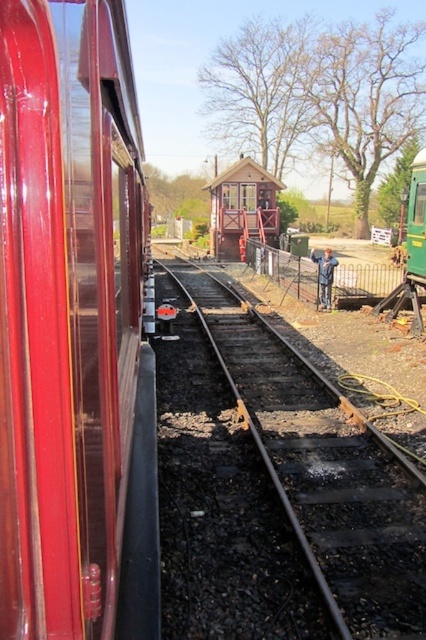
Is shiny red train car at left smaller than black metal track at center?

Yes, shiny red train car at left is smaller than black metal track at center.

Can you confirm if shiny red train car at left is thinner than black metal track at center?

Indeed, shiny red train car at left has a lesser width compared to black metal track at center.

Where is `shiny red train car at left`? This screenshot has width=426, height=640. shiny red train car at left is located at coordinates (74, 330).

Does point (261, 344) come farther from viewer compared to point (422, 195)?

That is False.

Who is positioned more to the left, black metal track at center or green matte train at center?

From the viewer's perspective, black metal track at center appears more on the left side.

Does point (290, 355) come behind point (423, 273)?

No.

Where is `black metal track at center`? black metal track at center is located at coordinates (322, 467).

Which is below, shiny red train car at left or green matte train at center?

shiny red train car at left is below.

Can you confirm if shiny red train car at left is positioned below green matte train at center?

Indeed, shiny red train car at left is positioned under green matte train at center.

You are a GUI agent. You are given a task and a screenshot of the screen. Output one action in this format:
    pyautogui.click(x=<x>, y=<y>)
    Task: Click on the shiny red train car at left
    This screenshot has width=426, height=640.
    Given the screenshot: What is the action you would take?
    pyautogui.click(x=74, y=330)